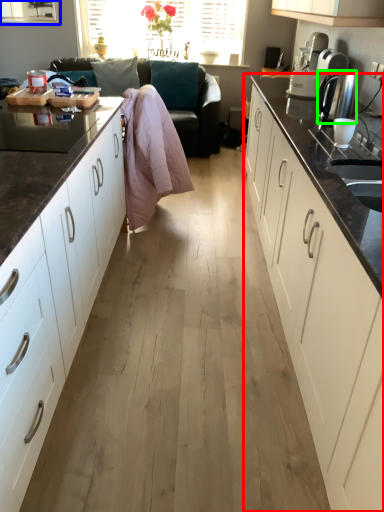
Question: Which object is positioned farthest from cabinetry (highlighted by a red box)? Select from window (highlighted by a blue box) and kitchen appliance (highlighted by a green box).

Choices:
 (A) window
 (B) kitchen appliance

Answer: (A)